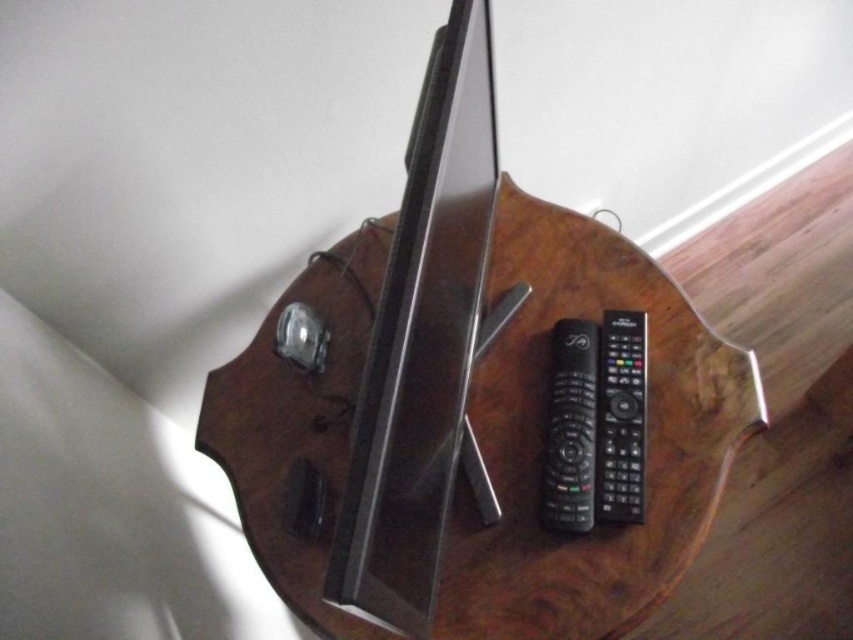
Who is more forward, (578, 490) or (627, 358)?

Point (578, 490) is in front.

Does point (570, 348) lie behind point (601, 348)?

No, (570, 348) is closer to viewer.

Between point (554, 349) and point (601, 419), which one is positioned in front?

Point (601, 419) is more forward.

At what (x,y) coordinates should I click in order to perform the action: click on black plastic remote at center. Please return your answer as a coordinate pair (x, y). This screenshot has height=640, width=853. Looking at the image, I should click on (570, 428).

Which of these two, wooden table at center or black plastic remote at right, stands taller?

wooden table at center

Between point (712, 500) and point (625, 480), which one is positioned in front?

Positioned in front is point (625, 480).

In order to click on wooden table at center in this screenshot , I will do `click(544, 435)`.

In order to click on wooden table at center in this screenshot , I will do `click(544, 435)`.

Can you confirm if wooden table at center is positioned above black plastic remote at center?

Yes.

Is point (315, 508) more distant than point (570, 474)?

Yes.

Where is `wooden table at center`? The width and height of the screenshot is (853, 640). wooden table at center is located at coordinates (544, 435).